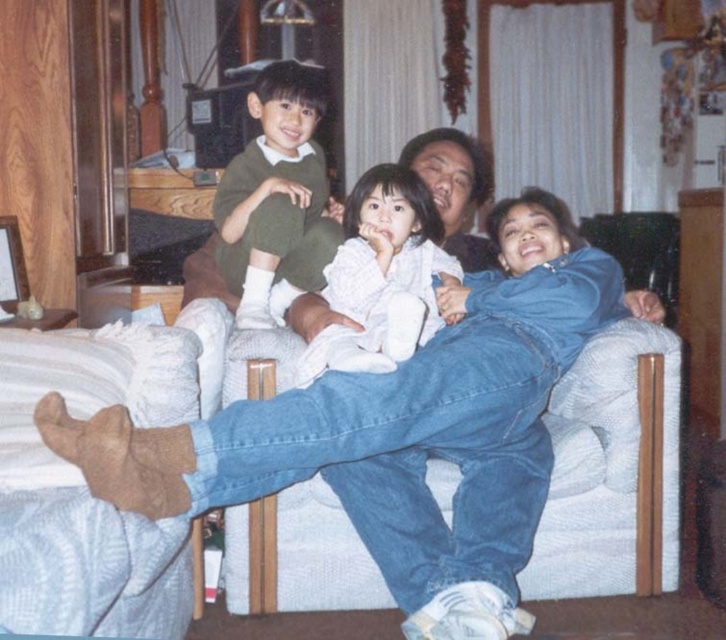
Question: Is matte green sweater at center further to camera compared to white soft blanket at center?

Choices:
 (A) no
 (B) yes

Answer: (B)

Question: Which point is farther to the camera?

Choices:
 (A) white soft blanket at center
 (B) matte green sweater at center

Answer: (B)

Question: Can you confirm if matte green sweater at center is wider than white soft blanket at center?

Choices:
 (A) no
 (B) yes

Answer: (A)

Question: Which point is farther from the camera taking this photo?

Choices:
 (A) (388, 307)
 (B) (280, 164)

Answer: (B)

Question: Among these objects, which one is farthest from the camera?

Choices:
 (A) white soft blanket at center
 (B) matte green sweater at center

Answer: (B)

Question: Can you confirm if matte green sweater at center is thinner than white soft blanket at center?

Choices:
 (A) yes
 (B) no

Answer: (A)